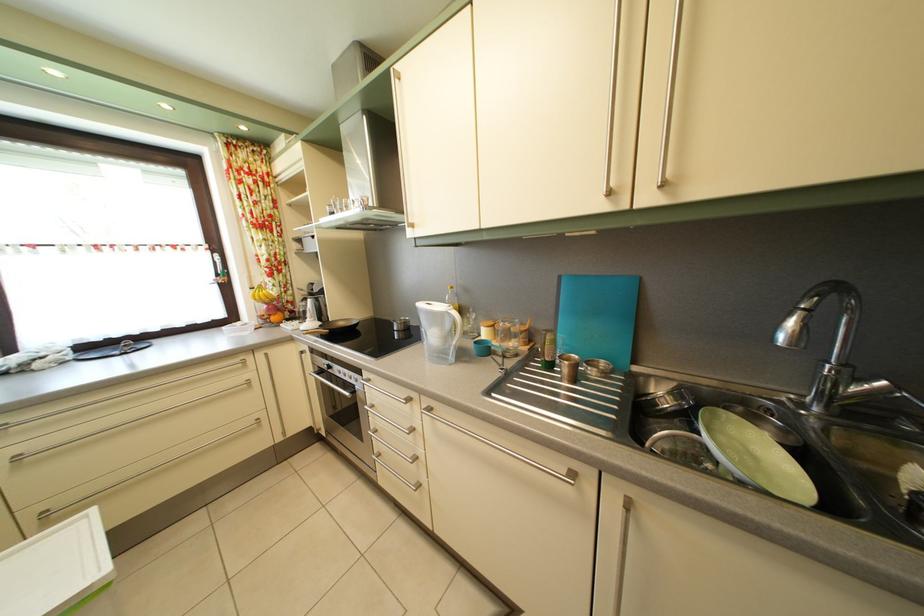
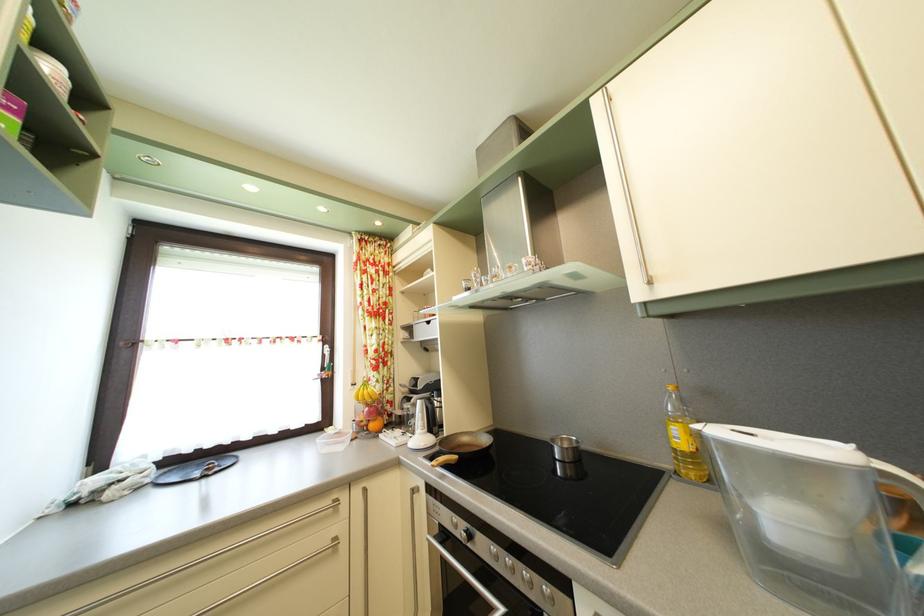
Where in the second image is the point corresponding to (331,390) from the first image?

(452, 567)